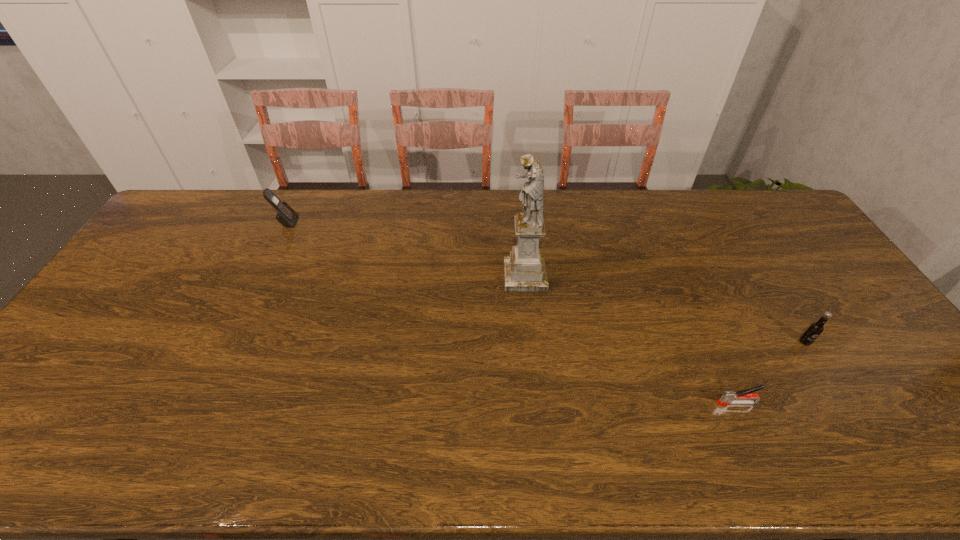
In the image, there is a desktop. At what (x,y) coordinates should I click in order to perform the action: click on free space at the far left corner. Please return your answer as a coordinate pair (x, y). The height and width of the screenshot is (540, 960). Looking at the image, I should click on (170, 225).

Where is `vacant space at the far right corner of the desktop`? Image resolution: width=960 pixels, height=540 pixels. vacant space at the far right corner of the desktop is located at coordinates (790, 221).

At what (x,y) coordinates should I click in order to perform the action: click on empty location between the farthest object and the sculpture. Please return your answer as a coordinate pair (x, y). Looking at the image, I should click on (406, 249).

Identify the location of empty location between the third nearest object and the rightmost object. The height and width of the screenshot is (540, 960). (665, 309).

This screenshot has height=540, width=960. Find the location of `free space between the farthest object and the nearest object`. free space between the farthest object and the nearest object is located at coordinates (512, 313).

This screenshot has height=540, width=960. In order to click on vacant point located between the rightmost object and the stapler in this screenshot , I will do `click(771, 373)`.

The image size is (960, 540). Find the location of `unoccupied area between the leftmost object and the second object from right to left`. unoccupied area between the leftmost object and the second object from right to left is located at coordinates click(512, 313).

I want to click on empty location between the cellular telephone and the third nearest object, so click(406, 249).

You are a GUI agent. You are given a task and a screenshot of the screen. Output one action in this format:
    pyautogui.click(x=<x>, y=<y>)
    Task: Click on the vacant region between the tallest object and the nearest object
    This screenshot has width=960, height=540.
    Given the screenshot: What is the action you would take?
    pyautogui.click(x=632, y=340)

The width and height of the screenshot is (960, 540). I want to click on free space between the root beer and the second farthest object, so click(665, 309).